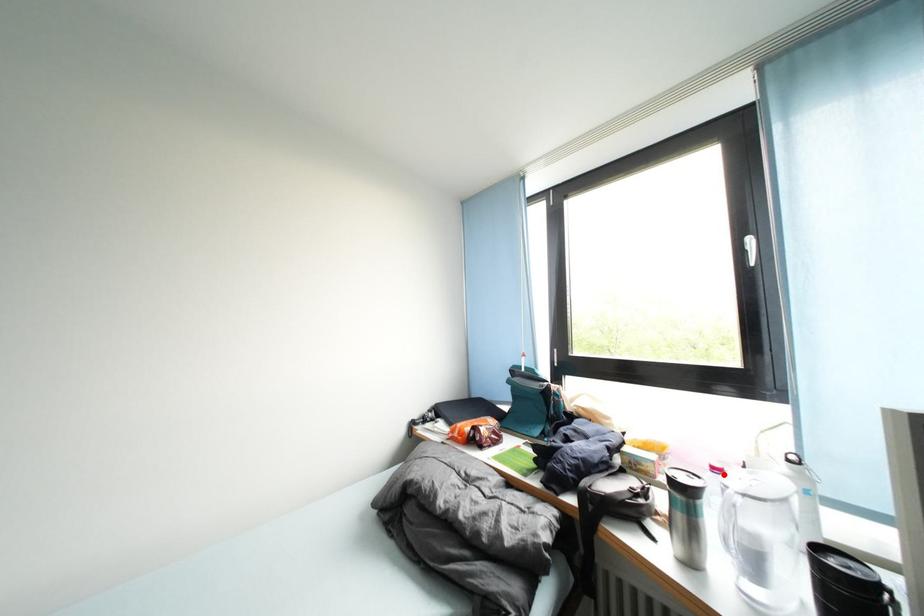
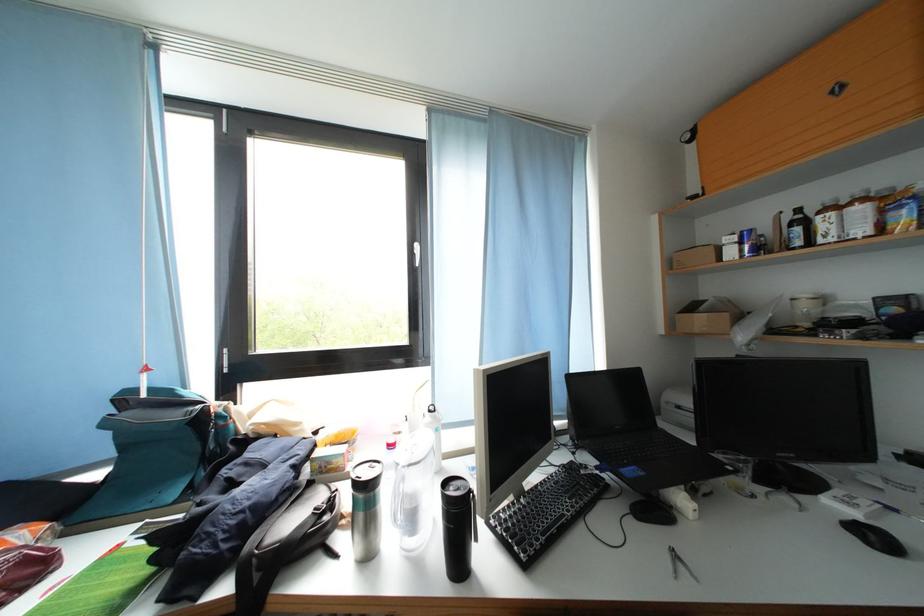
Question: I am providing you with two images of the same scene from different viewpoints. Given a red point in image1, look at the same physical point in image2. Is it:

Choices:
 (A) Closer to the viewpoint
 (B) Farther from the viewpoint

Answer: (A)